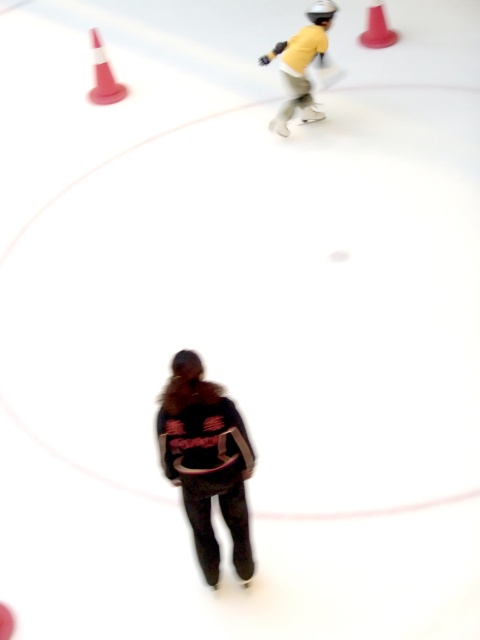
Question: Which object appears closest to the camera in this image?

Choices:
 (A) yellow matte skateboard at upper center
 (B) orange plastic cone at upper left
 (C) dark brown leather jacket at center

Answer: (C)

Question: Which of the following is the closest to the observer?

Choices:
 (A) smooth plastic cone at upper right
 (B) orange plastic cone at upper left
 (C) yellow matte skateboard at upper center

Answer: (C)

Question: Is dark brown leather jacket at center bigger than yellow matte skateboard at upper center?

Choices:
 (A) yes
 (B) no

Answer: (B)

Question: Which of the following is the closest to the observer?

Choices:
 (A) orange plastic cone at upper left
 (B) smooth plastic cone at upper right
 (C) dark brown leather jacket at center
 (D) yellow matte skateboard at upper center

Answer: (C)

Question: Observing the image, what is the correct spatial positioning of yellow matte skateboard at upper center in reference to orange plastic cone at upper left?

Choices:
 (A) above
 (B) below

Answer: (B)

Question: Can you confirm if dark brown leather jacket at center is positioned to the right of orange plastic cone at upper left?

Choices:
 (A) yes
 (B) no

Answer: (A)